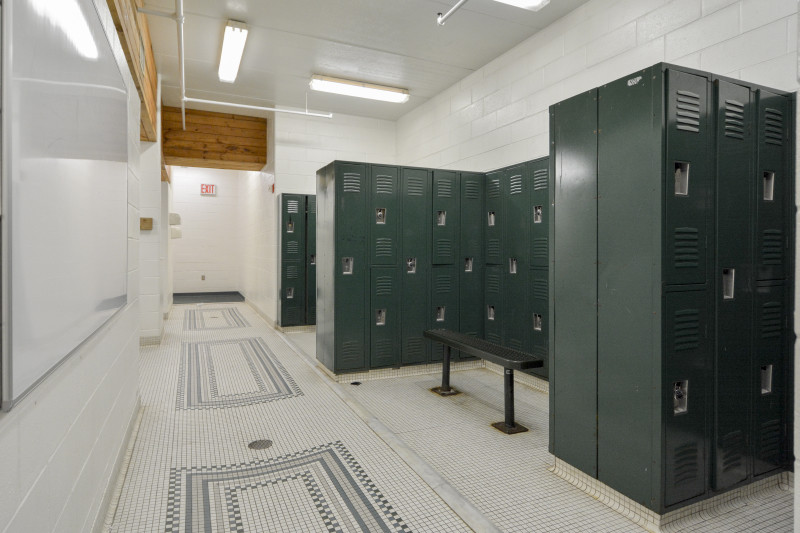
I want to click on bench, so click(x=501, y=356).